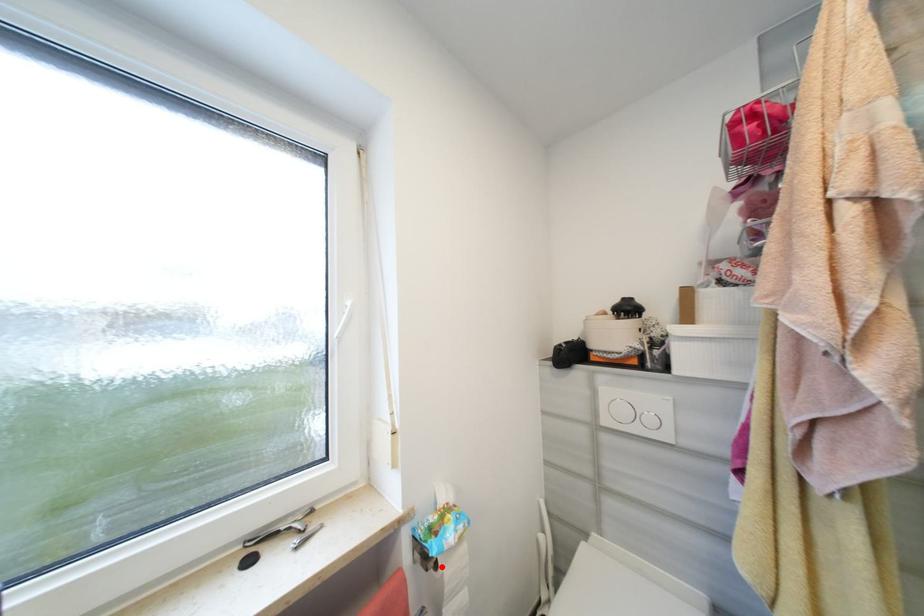
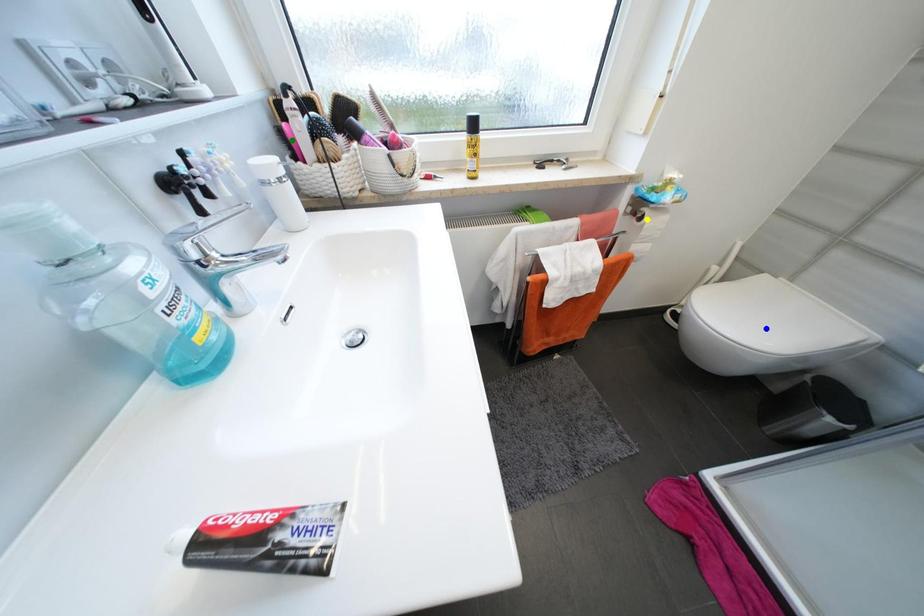
Question: I am providing you with two images of the same scene from different viewpoints. A red point is marked on the first image. You are given multiple points on the second image. Which mark in image 2 goes with the point in image 1?

Choices:
 (A) green point
 (B) yellow point
 (C) blue point

Answer: (B)